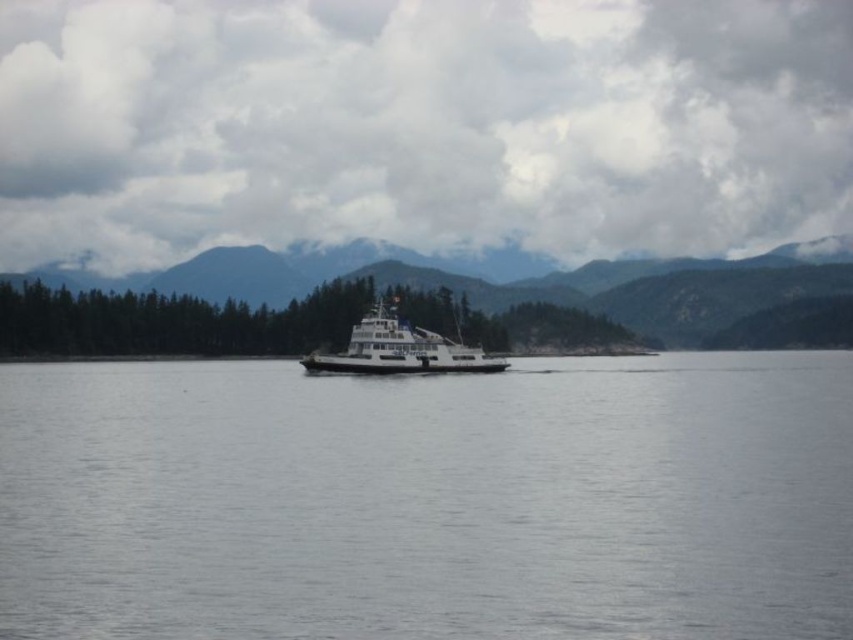
Question: Estimate the real-world distances between objects in this image. Which object is closer to the white matte ferry at center?

Choices:
 (A) clear water at center
 (B) green forested mountain at center

Answer: (A)

Question: Is clear water at center smaller than green forested mountain at center?

Choices:
 (A) yes
 (B) no

Answer: (A)

Question: Can you confirm if clear water at center is wider than green forested mountain at center?

Choices:
 (A) yes
 (B) no

Answer: (B)

Question: Among these points, which one is nearest to the camera?

Choices:
 (A) (398, 365)
 (B) (254, 296)

Answer: (A)

Question: Considering the real-world distances, which object is farthest from the green forested mountain at center?

Choices:
 (A) clear water at center
 (B) white matte ferry at center

Answer: (A)

Question: Can you confirm if green forested mountain at center is wider than white matte ferry at center?

Choices:
 (A) no
 (B) yes

Answer: (B)